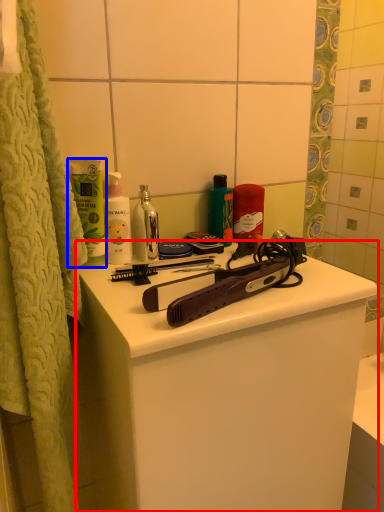
Question: Which object appears closest to the camera in this image, bathroom cabinet (highlighted by a red box) or mouthwash (highlighted by a blue box)?

Choices:
 (A) bathroom cabinet
 (B) mouthwash

Answer: (A)